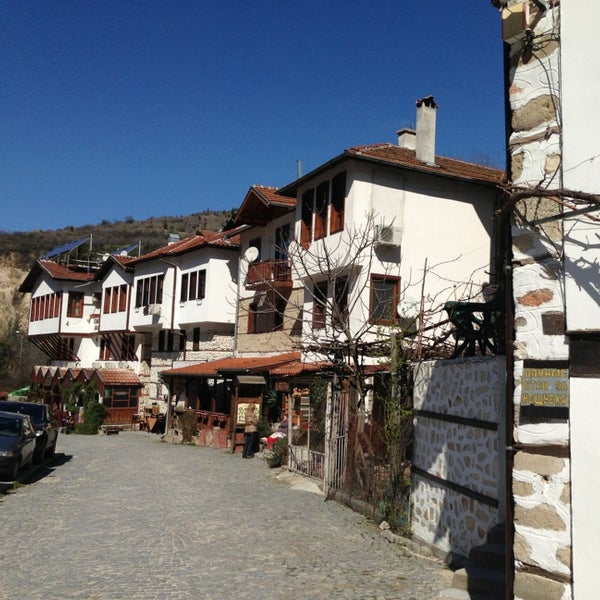
You are a GUI agent. You are given a task and a screenshot of the screen. Output one action in this format:
    pyautogui.click(x=<x>, y=<y>)
    Task: Click on the chimneys
    This screenshot has height=600, width=600.
    Given the screenshot: What is the action you would take?
    pyautogui.click(x=425, y=112), pyautogui.click(x=407, y=133)